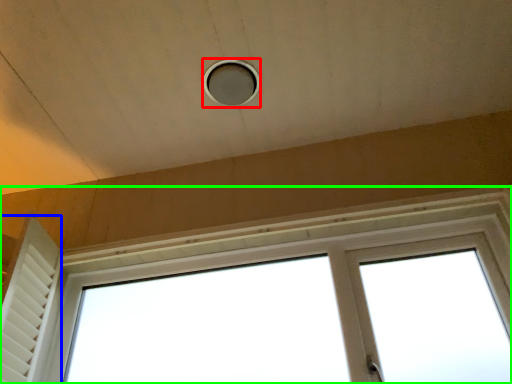
Question: Which is farther away from hole (highlighted by a red box)? shutter (highlighted by a blue box) or window (highlighted by a green box)?

Choices:
 (A) shutter
 (B) window

Answer: (A)